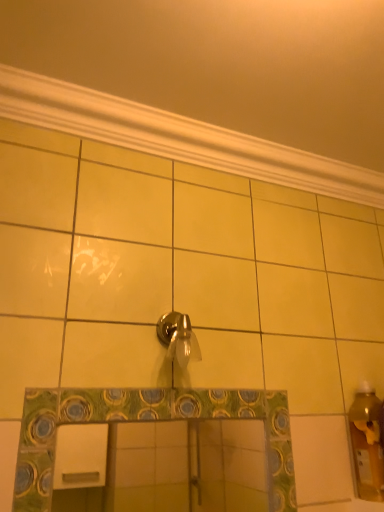
What do you see at coordinates (179, 137) in the screenshot? I see `white textured molding at upper center` at bounding box center [179, 137].

At what (x,y) coordinates should I click in order to perform the action: click on white textured molding at upper center. Please return your answer as a coordinate pair (x, y). Looking at the image, I should click on (179, 137).

What is the approximate height of white textured molding at upper center?

white textured molding at upper center is 3.75 inches tall.

Measure the distance between point (181, 315) and camera.

They are 3.42 feet apart.

The height and width of the screenshot is (512, 384). What do you see at coordinates (178, 338) in the screenshot?
I see `shiny metallic faucet at center` at bounding box center [178, 338].

At what (x,y) coordinates should I click in order to perform the action: click on shiny metallic faucet at center. Please return your answer as a coordinate pair (x, y). The width and height of the screenshot is (384, 512). Looking at the image, I should click on (178, 338).

Locate an element on the screen. white textured molding at upper center is located at coordinates (179, 137).

Which is more to the right, white textured molding at upper center or shiny metallic faucet at center?

white textured molding at upper center is more to the right.

Is the depth of white textured molding at upper center less than that of shiny metallic faucet at center?

No, it is not.

Considering the positions of points (1, 65) and (176, 318), is point (1, 65) closer to camera compared to point (176, 318)?

Yes.

From the image's perspective, between white textured molding at upper center and shiny metallic faucet at center, which one is located above?

white textured molding at upper center.

From a real-world perspective, does white textured molding at upper center sit lower than shiny metallic faucet at center?

Actually, white textured molding at upper center is physically above shiny metallic faucet at center in the real world.

Is white textured molding at upper center wider than shiny metallic faucet at center?

Indeed, white textured molding at upper center has a greater width compared to shiny metallic faucet at center.

Who is taller, white textured molding at upper center or shiny metallic faucet at center?

shiny metallic faucet at center is taller.

Between white textured molding at upper center and shiny metallic faucet at center, which one has larger size?

white textured molding at upper center is bigger.

Can we say white textured molding at upper center lies outside shiny metallic faucet at center?

white textured molding at upper center is positioned outside shiny metallic faucet at center.

Would you consider white textured molding at upper center to be distant from shiny metallic faucet at center?

No, white textured molding at upper center is in close proximity to shiny metallic faucet at center.

Is white textured molding at upper center positioned with its back to shiny metallic faucet at center?

No.

In order to click on tap lying below the white textured molding at upper center (from the image's perspective) in this screenshot , I will do `click(178, 338)`.

Considering the relative positions of shiny metallic faucet at center and white textured molding at upper center in the image provided, is shiny metallic faucet at center to the right of white textured molding at upper center from the viewer's perspective?

In fact, shiny metallic faucet at center is to the left of white textured molding at upper center.

Considering the positions of objects shiny metallic faucet at center and white textured molding at upper center in the image provided, who is behind, shiny metallic faucet at center or white textured molding at upper center?

white textured molding at upper center is more distant.

Between point (183, 330) and point (115, 139), which one is positioned in front?

Point (183, 330)

From the image's perspective, is shiny metallic faucet at center below white textured molding at upper center?

Correct, shiny metallic faucet at center appears lower than white textured molding at upper center in the image.

From a real-world perspective, is shiny metallic faucet at center beneath white textured molding at upper center?

Yes, from a real-world perspective, shiny metallic faucet at center is below white textured molding at upper center.

Based on the photo, can you confirm if shiny metallic faucet at center is thinner than white textured molding at upper center?

Yes, shiny metallic faucet at center is thinner than white textured molding at upper center.

Does shiny metallic faucet at center have a greater height compared to white textured molding at upper center?

Correct, shiny metallic faucet at center is much taller as white textured molding at upper center.

Based on their sizes in the image, would you say shiny metallic faucet at center is bigger or smaller than white textured molding at upper center?

Considering their sizes, shiny metallic faucet at center takes up less space than white textured molding at upper center.

Is shiny metallic faucet at center positioned beyond the bounds of white textured molding at upper center?

Yes, shiny metallic faucet at center is located beyond the bounds of white textured molding at upper center.

Is shiny metallic faucet at center next to white textured molding at upper center?

No, shiny metallic faucet at center is not with white textured molding at upper center.

Is shiny metallic faucet at center oriented towards white textured molding at upper center?

No, shiny metallic faucet at center does not turn towards white textured molding at upper center.

How different are the orientations of shiny metallic faucet at center and white textured molding at upper center in degrees?

0.371 degrees separate the facing orientations of shiny metallic faucet at center and white textured molding at upper center.

You are a GUI agent. You are given a task and a screenshot of the screen. Output one action in this format:
    pyautogui.click(x=<x>, y=<y>)
    Task: Click on the tap below the white textured molding at upper center (from the image's perspective)
    The width and height of the screenshot is (384, 512).
    Given the screenshot: What is the action you would take?
    pyautogui.click(x=178, y=338)

The width and height of the screenshot is (384, 512). I want to click on tap on the left of white textured molding at upper center, so click(178, 338).

Image resolution: width=384 pixels, height=512 pixels. In order to click on molding that is behind the shiny metallic faucet at center in this screenshot , I will do `click(179, 137)`.